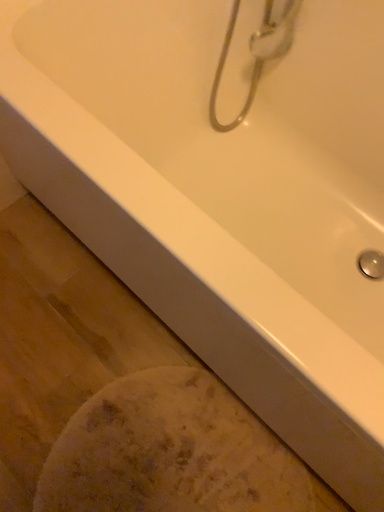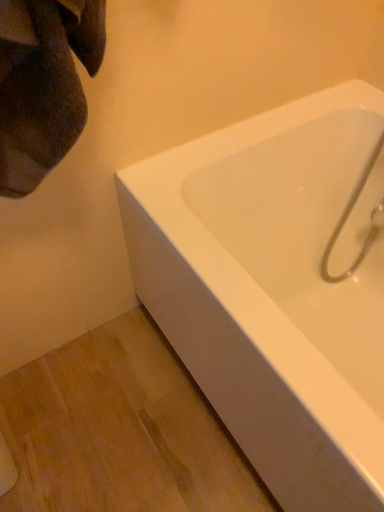
Question: How did the camera likely rotate when shooting the video?

Choices:
 (A) rotated left
 (B) rotated right

Answer: (A)